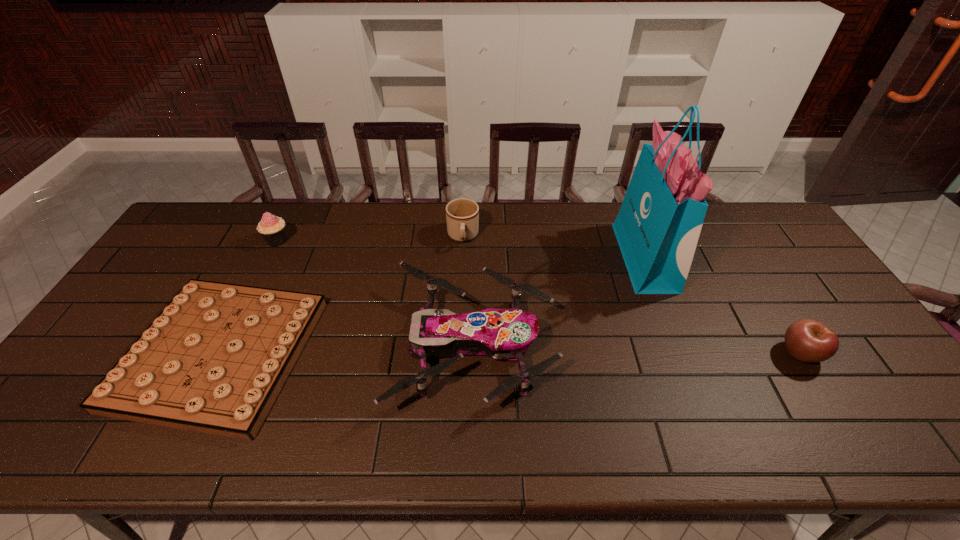
You are a GUI agent. You are given a task and a screenshot of the screen. Output one action in this format:
    pyautogui.click(x=<x>, y=<y>)
    Task: Click on the tallest object
    The image size is (960, 540).
    Given the screenshot: What is the action you would take?
    pyautogui.click(x=658, y=226)

Locate an element on the screen. Image resolution: width=960 pixels, height=540 pixels. shopping bag is located at coordinates point(658,226).

This screenshot has width=960, height=540. Find the location of `cupcake`. cupcake is located at coordinates (272, 229).

What are the coordinates of `mug` in the screenshot? It's located at (462, 215).

Identify the location of drone. pos(503,334).

Locate an element on the screen. The height and width of the screenshot is (540, 960). apple is located at coordinates (807, 340).

Locate an element on the screen. the shortest object is located at coordinates click(214, 360).

Find the location of a particular element. free space located on the left of the fifth object from left to right is located at coordinates (497, 258).

You are a GUI agent. You are given a task and a screenshot of the screen. Output one action in this format:
    pyautogui.click(x=<x>, y=<y>)
    Task: Click on the free location located 0.340m on the right of the cupcake
    The image size is (960, 540).
    Given the screenshot: What is the action you would take?
    pyautogui.click(x=394, y=240)

At what (x,y) coordinates should I click in order to perform the action: click on vacant space located on the side of the mug with the handle. Please return your answer as a coordinate pair (x, y). The height and width of the screenshot is (540, 960). Looking at the image, I should click on (458, 351).